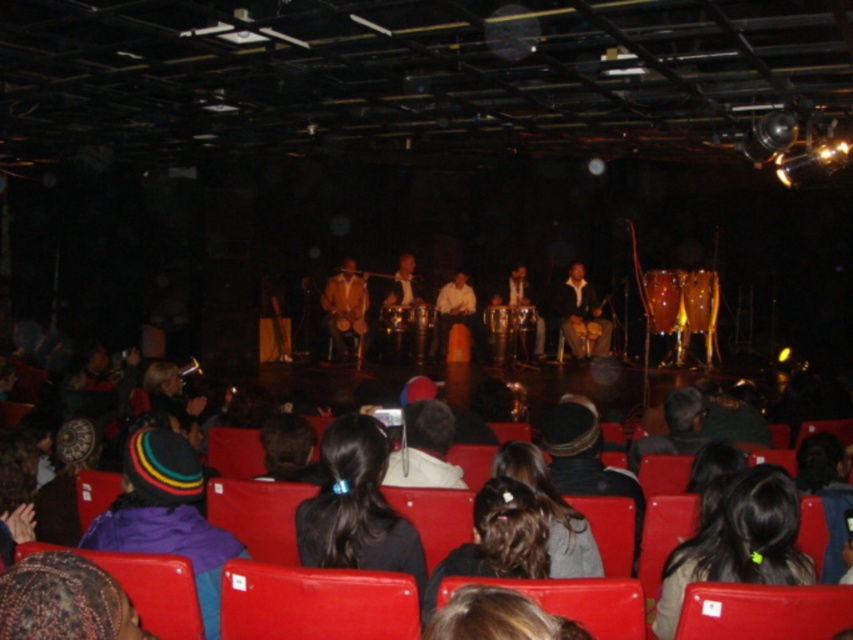
Question: Can you confirm if black hair at center is bigger than matte brown drum at center?

Choices:
 (A) no
 (B) yes

Answer: (A)

Question: Which of the following is the closest to the observer?

Choices:
 (A) (526, 301)
 (B) (222, 477)

Answer: (B)

Question: Which object is positioned farthest from the leather jacket at center?

Choices:
 (A) black leather jacket at center
 (B) smooth brown drum at center

Answer: (A)

Question: Can you confirm if black leather jacket at center is thinner than matte brown drum at center?

Choices:
 (A) no
 (B) yes

Answer: (B)

Question: Is matte brown drum at center to the left of smooth brown drum at center from the viewer's perspective?

Choices:
 (A) no
 (B) yes

Answer: (A)

Question: Which point appears farthest from the camera in this image?

Choices:
 (A) (471, 310)
 (B) (347, 275)
 (C) (752, 621)

Answer: (A)